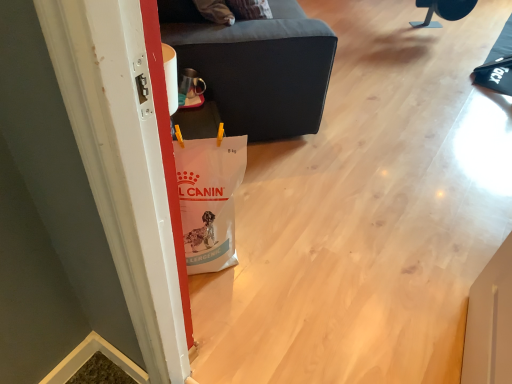
Question: Considering the relative sizes of dark gray fabric ottoman at center, the 1th furniture positioned from the left, and black plastic chair at upper right, which appears as the 2th furniture when ordered from the bottom, in the image provided, is dark gray fabric ottoman at center, the 1th furniture positioned from the left, bigger than black plastic chair at upper right, which appears as the 2th furniture when ordered from the bottom,?

Choices:
 (A) no
 (B) yes

Answer: (B)

Question: Is dark gray fabric ottoman at center, the second furniture positioned from the back, to the left of black plastic chair at upper right, which is the 1th furniture from right to left, from the viewer's perspective?

Choices:
 (A) yes
 (B) no

Answer: (A)

Question: Is dark gray fabric ottoman at center, the second furniture positioned from the back, completely or partially outside of black plastic chair at upper right, which is counted as the first furniture, starting from the back?

Choices:
 (A) no
 (B) yes

Answer: (B)

Question: Could you tell me if dark gray fabric ottoman at center, marked as the 2th furniture in a top-to-bottom arrangement, is turned towards black plastic chair at upper right, positioned as the 2th furniture in front-to-back order?

Choices:
 (A) yes
 (B) no

Answer: (A)

Question: Is dark gray fabric ottoman at center, the first furniture when ordered from bottom to top, at the right side of black plastic chair at upper right, the second furniture when ordered from left to right?

Choices:
 (A) yes
 (B) no

Answer: (B)

Question: Does dark gray fabric ottoman at center, which appears as the 1th furniture when viewed from the front, have a lesser height compared to black plastic chair at upper right, positioned as the 2th furniture in front-to-back order?

Choices:
 (A) yes
 (B) no

Answer: (B)

Question: Can you confirm if black plastic chair at upper right, which is the 1th furniture from right to left, is thinner than dark gray fabric ottoman at center, arranged as the second furniture when viewed from the right?

Choices:
 (A) yes
 (B) no

Answer: (A)

Question: Does black plastic chair at upper right, which is counted as the first furniture, starting from the back, have a smaller size compared to dark gray fabric ottoman at center, the first furniture when ordered from bottom to top?

Choices:
 (A) yes
 (B) no

Answer: (A)

Question: Is black plastic chair at upper right, the second furniture when ordered from left to right, to the right of dark gray fabric ottoman at center, the 1th furniture positioned from the left, from the viewer's perspective?

Choices:
 (A) no
 (B) yes

Answer: (B)

Question: Considering the relative sizes of black plastic chair at upper right, positioned as the 2th furniture in front-to-back order, and dark gray fabric ottoman at center, marked as the 2th furniture in a top-to-bottom arrangement, in the image provided, is black plastic chair at upper right, positioned as the 2th furniture in front-to-back order, taller than dark gray fabric ottoman at center, marked as the 2th furniture in a top-to-bottom arrangement,?

Choices:
 (A) no
 (B) yes

Answer: (A)

Question: From the image's perspective, does black plastic chair at upper right, which ranks as the 1th furniture in top-to-bottom order, appear lower than dark gray fabric ottoman at center, the first furniture when ordered from bottom to top?

Choices:
 (A) no
 (B) yes

Answer: (A)

Question: Is black plastic chair at upper right, which appears as the 2th furniture when ordered from the bottom, bigger than dark gray fabric ottoman at center, arranged as the second furniture when viewed from the right?

Choices:
 (A) yes
 (B) no

Answer: (B)

Question: Which is correct: black plastic chair at upper right, positioned as the 2th furniture in front-to-back order, is inside dark gray fabric ottoman at center, marked as the 2th furniture in a top-to-bottom arrangement, or outside of it?

Choices:
 (A) inside
 (B) outside

Answer: (B)